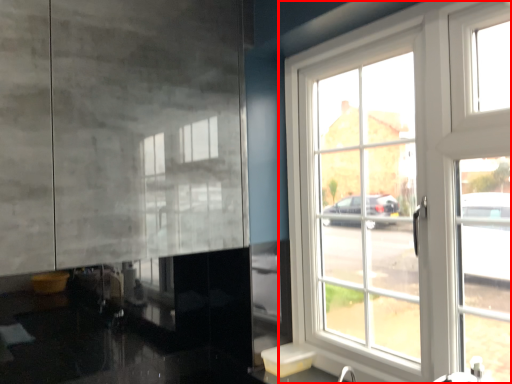
Question: From the image's perspective, what is the correct spatial relationship of window (annotated by the red box) in relation to sink?

Choices:
 (A) below
 (B) above

Answer: (B)